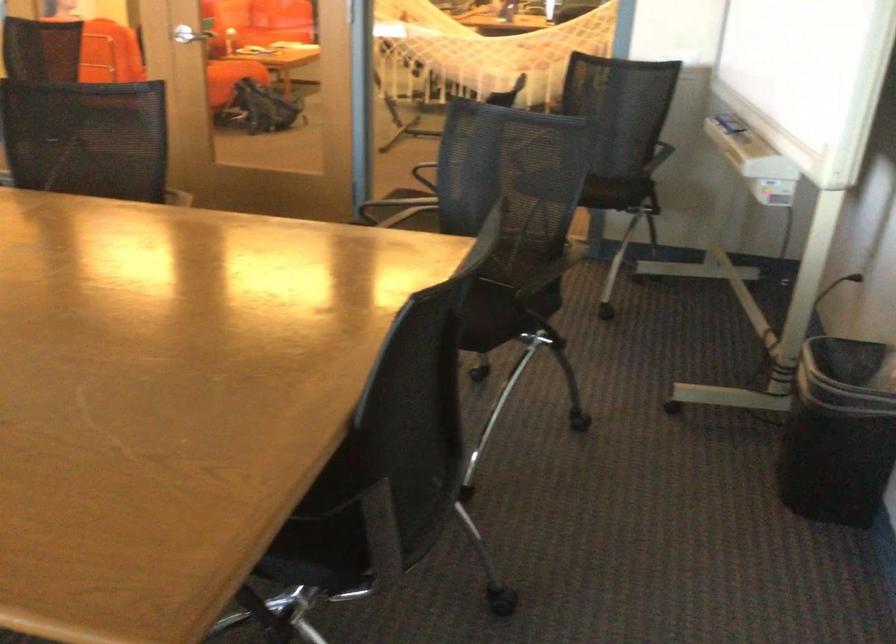
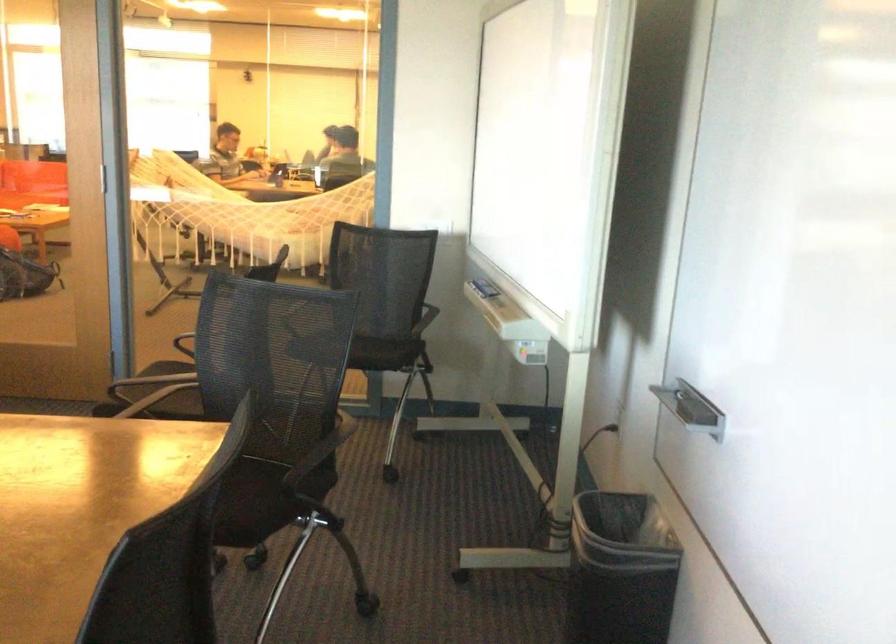
Where in the second image is the point corresponding to point 606,190 from the first image?

(376, 354)